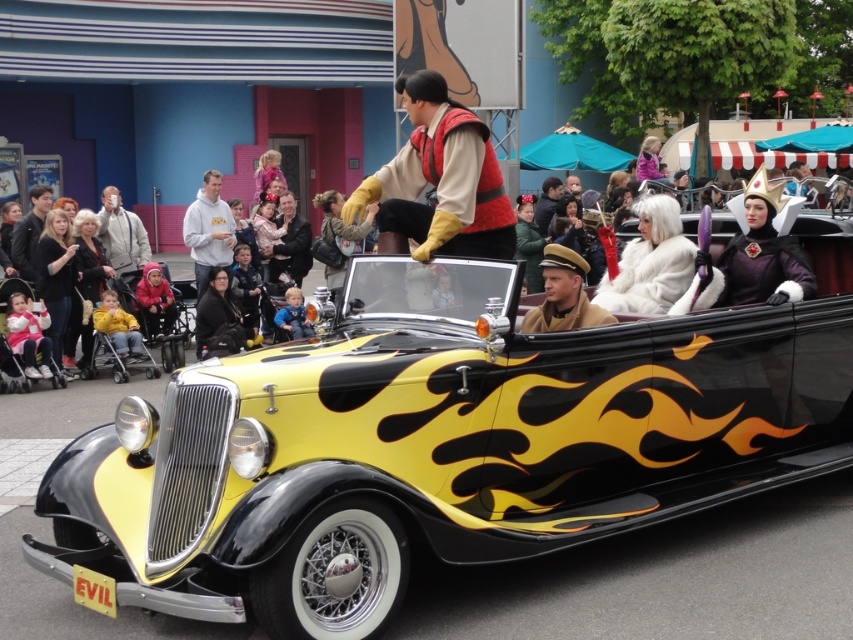
You are a photographer at the parade and want to capture both the brown leather hat at center and the yellow fleece jacket at lower left in a single frame. Given that your camera has a limited focus range, which object should you prioritize focusing on to ensure clarity, considering their sizes?

The brown leather hat at center is larger in size than the yellow fleece jacket at lower left, so focusing on the brown leather hat at center would ensure clarity due to its prominence in the frame.

You are a photographer at the parade and want to take a photo of the vintage car with both the brown leather hat at center and the white fleece sweatshirt at center visible. Based on their positions, which one might be more challenging to capture in the frame?

The brown leather hat at center is below the white fleece sweatshirt at center, so it might be more challenging to capture the brown leather hat at center in the frame if the camera angle is focused on the upper part where the white fleece sweatshirt at center is located.

You are a photographer at the parade and want to take a photo of the white plush teddy bear at lower left and the brown leather hat at center. Which object is located to the right of the other?

The brown leather hat at center is positioned on the right side of white plush teddy bear at lower left.